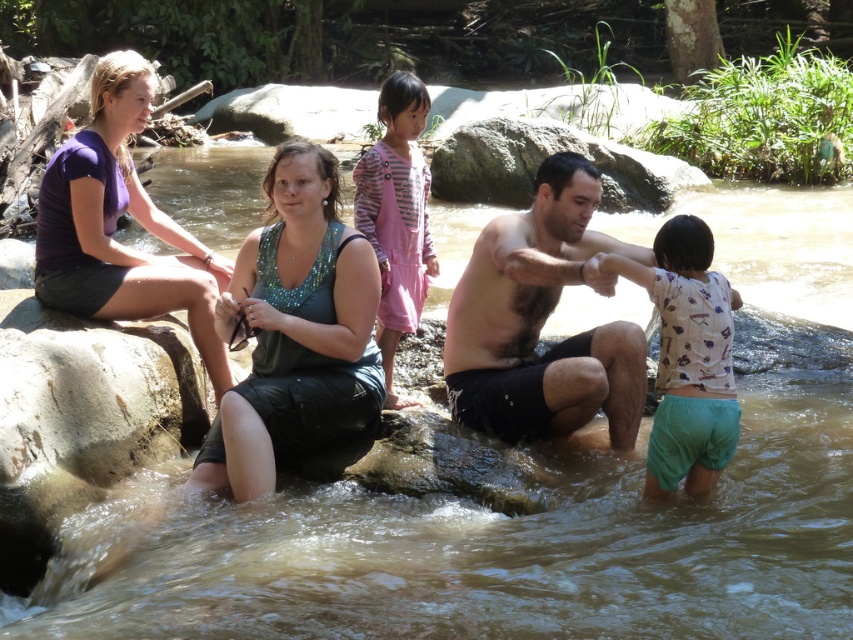
You are a photographer trying to capture a photo of the two women by the stream. You want to ensure that the green sequined tank top at center and the purple matte shirt at left are both visible in the frame. Based on their positions, which woman should you focus on first to make sure both are in the shot?

The green sequined tank top at center is located below the purple matte shirt at left. To ensure both are visible, focus on the purple matte shirt at left first, as it is higher up, allowing the camera to capture the lower positioned green sequined tank top at center in the same frame.

You are trying to locate the purple matte shirt at left and the white printed shirt at lower right in the scene. Based on their positions, which one is closer to the water surface?

The purple matte shirt at left is positioned over the white printed shirt at lower right, meaning it is closer to the water surface.